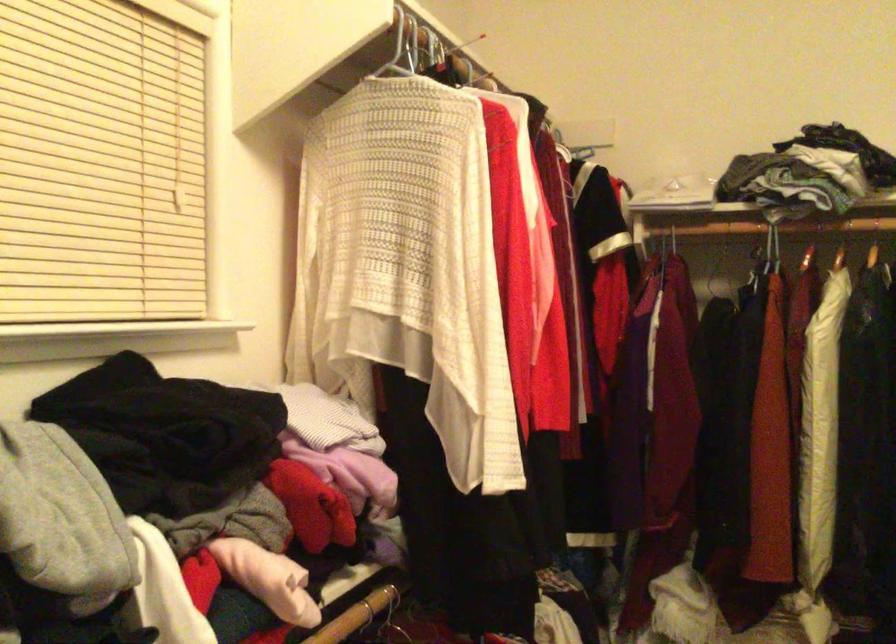
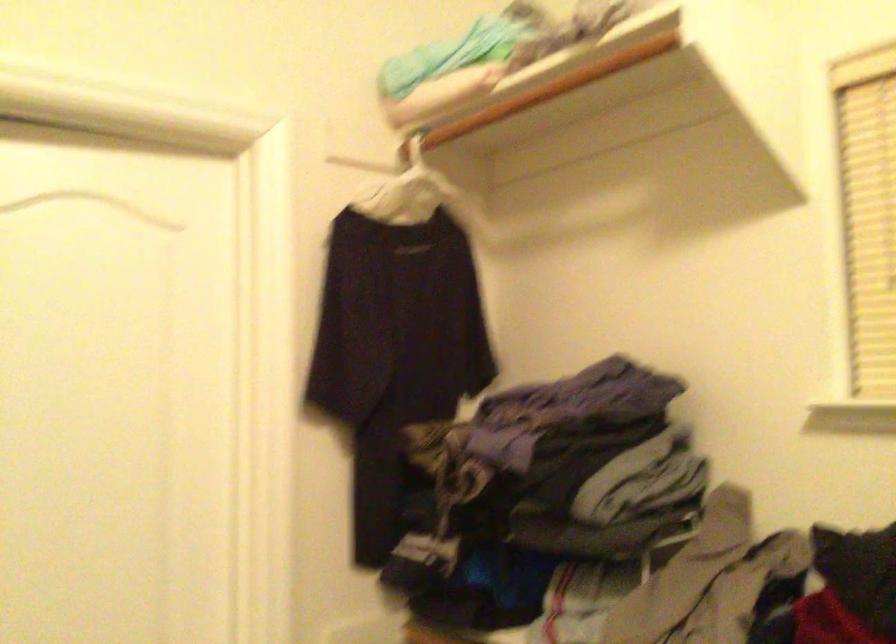
Question: The camera is either moving clockwise (left) or counter-clockwise (right) around the object. The first image is from the beginning of the video and the second image is from the end. Is the camera moving left or right when shooting the video?

Choices:
 (A) Left
 (B) Right

Answer: (B)